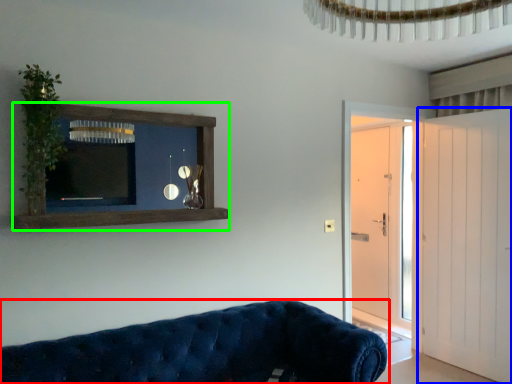
Question: Estimate the real-world distances between objects in this image. Which object is closer to studio couch (highlighted by a red box), door (highlighted by a blue box) or shelf (highlighted by a green box)?

Choices:
 (A) door
 (B) shelf

Answer: (B)